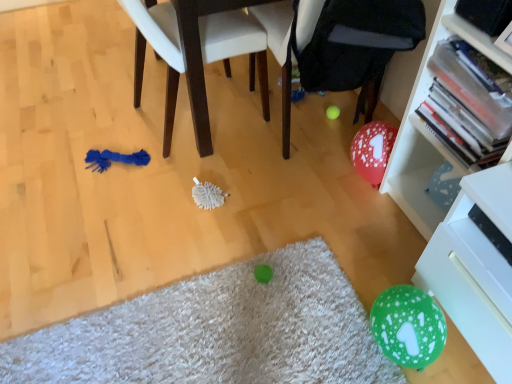
Locate an element on the screen. This screenshot has width=512, height=384. vacant space situated on the left part of blue fabric chair at left is located at coordinates (93, 114).